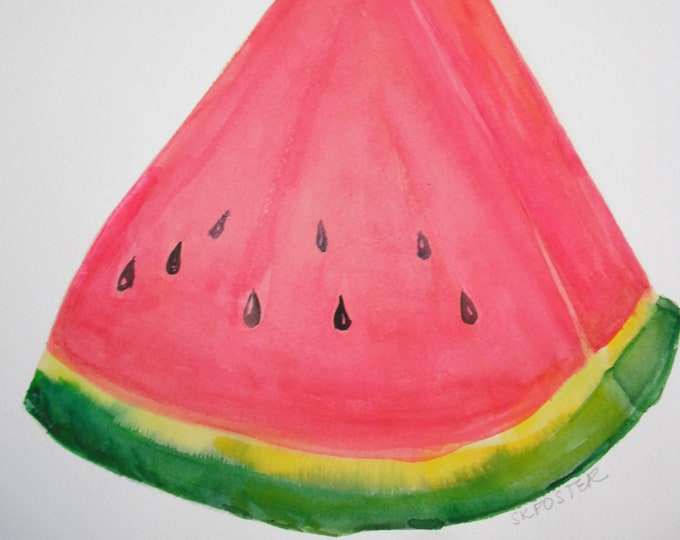
You are a GUI agent. You are given a task and a screenshot of the screen. Output one action in this format:
    pyautogui.click(x=<x>, y=<y>)
    Task: Click on the green paint smudge that has bled into the yellow paint toward the bottom left
    This screenshot has width=680, height=540.
    Given the screenshot: What is the action you would take?
    pyautogui.click(x=116, y=406)